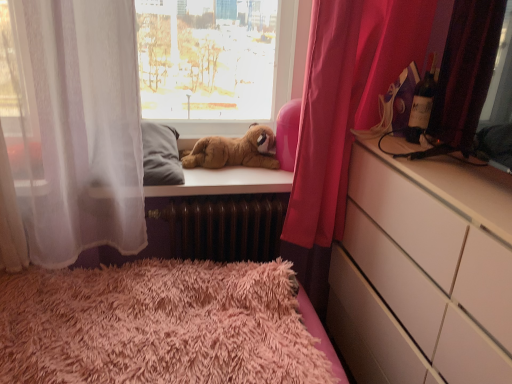
The width and height of the screenshot is (512, 384). What are the coordinates of `matte glass bottle at right` in the screenshot? It's located at (422, 103).

What do you see at coordinates (466, 71) in the screenshot? I see `velvet dark red curtain at right, marked as the second curtain in a back-to-front arrangement` at bounding box center [466, 71].

Where is `brown plush bear at upper center`? brown plush bear at upper center is located at coordinates (232, 151).

Measure the distance between point (238, 155) and camera.

6.08 feet.

The image size is (512, 384). In order to click on white glossy chest of drawers at right in this screenshot , I will do `click(424, 272)`.

Where is `matte glass bottle at right`? This screenshot has height=384, width=512. matte glass bottle at right is located at coordinates (422, 103).

Which is nearer, (467,354) or (415,127)?

The point (467,354) is closer.

Image resolution: width=512 pixels, height=384 pixels. There is a white glossy chest of drawers at right. In order to click on bottle above it (from a real-world perspective) in this screenshot , I will do [x=422, y=103].

Is white glossy chest of drawers at right oriented away from matte glass bottle at right?

No, white glossy chest of drawers at right is not facing the opposite direction of matte glass bottle at right.

How much distance is there between velvet dark red curtain at right, marked as the second curtain in a back-to-front arrangement, and pink fabric curtain at right, acting as the second curtain starting from the front?

velvet dark red curtain at right, marked as the second curtain in a back-to-front arrangement, and pink fabric curtain at right, acting as the second curtain starting from the front, are 14.71 inches apart.

From the picture: Would you consider velvet dark red curtain at right, acting as the first curtain starting from the front, to be distant from pink fabric curtain at right, which is the 1th curtain in back-to-front order?

Actually, velvet dark red curtain at right, acting as the first curtain starting from the front, and pink fabric curtain at right, which is the 1th curtain in back-to-front order, are a little close together.

Does velvet dark red curtain at right, acting as the first curtain starting from the front, turn towards pink fabric curtain at right, acting as the second curtain starting from the front?

No.

Considering the sizes of velvet dark red curtain at right, acting as the first curtain starting from the front, and pink fabric curtain at right, acting as the second curtain starting from the front, in the image, is velvet dark red curtain at right, acting as the first curtain starting from the front, taller or shorter than pink fabric curtain at right, acting as the second curtain starting from the front,?

In the image, velvet dark red curtain at right, acting as the first curtain starting from the front, appears to be shorter than pink fabric curtain at right, acting as the second curtain starting from the front.

From the picture: From a real-world perspective, is brown plush bear at upper center under velvet dark red curtain at right, acting as the first curtain starting from the front?

Yes, from a real-world perspective, brown plush bear at upper center is beneath velvet dark red curtain at right, acting as the first curtain starting from the front.

Can you confirm if brown plush bear at upper center is bigger than velvet dark red curtain at right, marked as the second curtain in a back-to-front arrangement?

Actually, brown plush bear at upper center might be smaller than velvet dark red curtain at right, marked as the second curtain in a back-to-front arrangement.

Looking at this image, is brown plush bear at upper center oriented towards velvet dark red curtain at right, acting as the first curtain starting from the front?

No, brown plush bear at upper center is not oriented towards velvet dark red curtain at right, acting as the first curtain starting from the front.

Which object is more forward, white glossy chest of drawers at right or brown plush bear at upper center?

white glossy chest of drawers at right is more forward.

Considering the positions of objects white glossy chest of drawers at right and brown plush bear at upper center in the image provided, who is more to the left, white glossy chest of drawers at right or brown plush bear at upper center?

brown plush bear at upper center.

Considering the sizes of objects white glossy chest of drawers at right and brown plush bear at upper center in the image provided, who is taller, white glossy chest of drawers at right or brown plush bear at upper center?

With more height is white glossy chest of drawers at right.

Can you see white glossy chest of drawers at right touching brown plush bear at upper center?

No, white glossy chest of drawers at right is not making contact with brown plush bear at upper center.

From a real-world perspective, is velvet dark red curtain at right, marked as the second curtain in a back-to-front arrangement, beneath white glossy chest of drawers at right?

No, from a real-world perspective, velvet dark red curtain at right, marked as the second curtain in a back-to-front arrangement, is not below white glossy chest of drawers at right.

Is velvet dark red curtain at right, marked as the second curtain in a back-to-front arrangement, facing away from white glossy chest of drawers at right?

That's not correct — velvet dark red curtain at right, marked as the second curtain in a back-to-front arrangement, is not looking away from white glossy chest of drawers at right.

You are a GUI agent. You are given a task and a screenshot of the screen. Output one action in this format:
    pyautogui.click(x=<x>, y=<y>)
    Task: Click on the chest of drawers below the velvet dark red curtain at right, marked as the second curtain in a back-to-front arrangement (from the image's perspective)
    The height and width of the screenshot is (384, 512).
    Given the screenshot: What is the action you would take?
    pyautogui.click(x=424, y=272)

How many degrees apart are the facing directions of velvet dark red curtain at right, acting as the first curtain starting from the front, and white glossy chest of drawers at right?

The angle between the facing direction of velvet dark red curtain at right, acting as the first curtain starting from the front, and the facing direction of white glossy chest of drawers at right is 0.0898 degrees.

Is white glossy chest of drawers at right looking in the opposite direction of pink fabric curtain at right, which is the 1th curtain in back-to-front order?

No, white glossy chest of drawers at right is not facing the opposite direction of pink fabric curtain at right, which is the 1th curtain in back-to-front order.

Is white glossy chest of drawers at right placed right next to pink fabric curtain at right, which is the 1th curtain in back-to-front order?

There is a gap between white glossy chest of drawers at right and pink fabric curtain at right, which is the 1th curtain in back-to-front order.

Can you confirm if white glossy chest of drawers at right is bigger than pink fabric curtain at right, acting as the second curtain starting from the front?

Correct, white glossy chest of drawers at right is larger in size than pink fabric curtain at right, acting as the second curtain starting from the front.

Is point (416, 320) farther from viewer compared to point (291, 243)?

No.

From the image's perspective, between velvet dark red curtain at right, marked as the second curtain in a back-to-front arrangement, and matte glass bottle at right, which one is located above?

matte glass bottle at right, from the image's perspective.

Looking at this image, considering the sizes of velvet dark red curtain at right, acting as the first curtain starting from the front, and matte glass bottle at right in the image, is velvet dark red curtain at right, acting as the first curtain starting from the front, taller or shorter than matte glass bottle at right?

A: Considering their sizes, velvet dark red curtain at right, acting as the first curtain starting from the front, has more height than matte glass bottle at right.

What's the angular difference between velvet dark red curtain at right, acting as the first curtain starting from the front, and matte glass bottle at right's facing directions?

0.552 degrees.

From a real-world perspective, is velvet dark red curtain at right, marked as the second curtain in a back-to-front arrangement, physically located above or below matte glass bottle at right?

velvet dark red curtain at right, marked as the second curtain in a back-to-front arrangement, is situated higher than matte glass bottle at right in the real world.

The width and height of the screenshot is (512, 384). Find the location of `chest of drawers below the matte glass bottle at right (from the image's perspective)`. chest of drawers below the matte glass bottle at right (from the image's perspective) is located at coordinates (424, 272).

Where is `curtain on the right of pink fabric curtain at right, acting as the second curtain starting from the front`? curtain on the right of pink fabric curtain at right, acting as the second curtain starting from the front is located at coordinates (466, 71).

When comparing their distances from brown plush bear at upper center, does velvet dark red curtain at right, marked as the second curtain in a back-to-front arrangement, or matte glass bottle at right seem closer?

Among the two, matte glass bottle at right is located nearer to brown plush bear at upper center.

Looking at the image, which one is located closer to matte glass bottle at right, velvet dark red curtain at right, acting as the first curtain starting from the front, or white glossy chest of drawers at right?

velvet dark red curtain at right, acting as the first curtain starting from the front, is closer to matte glass bottle at right.

Based on their spatial positions, is velvet dark red curtain at right, acting as the first curtain starting from the front, or pink fabric curtain at right, which is the 1th curtain in back-to-front order, closer to white glossy chest of drawers at right?

The object closer to white glossy chest of drawers at right is velvet dark red curtain at right, acting as the first curtain starting from the front.

When comparing their distances from white glossy chest of drawers at right, does matte glass bottle at right or velvet dark red curtain at right, marked as the second curtain in a back-to-front arrangement, seem closer?

velvet dark red curtain at right, marked as the second curtain in a back-to-front arrangement.

Estimate the real-world distances between objects in this image. Which object is further from velvet dark red curtain at right, marked as the second curtain in a back-to-front arrangement, white glossy chest of drawers at right or brown plush bear at upper center?

brown plush bear at upper center lies further to velvet dark red curtain at right, marked as the second curtain in a back-to-front arrangement, than the other object.

From the image, which object appears to be nearer to matte glass bottle at right, brown plush bear at upper center or pink fabric curtain at right, which is the 1th curtain in back-to-front order?

pink fabric curtain at right, which is the 1th curtain in back-to-front order, is positioned closer to the anchor matte glass bottle at right.

When comparing their distances from matte glass bottle at right, does white glossy chest of drawers at right or velvet dark red curtain at right, acting as the first curtain starting from the front, seem closer?

Based on the image, velvet dark red curtain at right, acting as the first curtain starting from the front, appears to be nearer to matte glass bottle at right.

Considering their positions, is pink fabric curtain at right, which is the 1th curtain in back-to-front order, positioned closer to white glossy chest of drawers at right than matte glass bottle at right?

Based on the image, pink fabric curtain at right, which is the 1th curtain in back-to-front order, appears to be nearer to white glossy chest of drawers at right.

Find the location of a particular element. Image resolution: width=512 pixels, height=384 pixels. curtain between velvet dark red curtain at right, marked as the second curtain in a back-to-front arrangement, and white glossy chest of drawers at right, in the vertical direction is located at coordinates (343, 117).

At what (x,y) coordinates should I click in order to perform the action: click on the chest of drawers located between velvet dark red curtain at right, acting as the first curtain starting from the front, and brown plush bear at upper center in the depth direction. Please return your answer as a coordinate pair (x, y). This screenshot has height=384, width=512. Looking at the image, I should click on (424, 272).

Locate an element on the screen. The width and height of the screenshot is (512, 384). curtain between brown plush bear at upper center and matte glass bottle at right from left to right is located at coordinates (343, 117).

Identify the location of curtain between velvet dark red curtain at right, marked as the second curtain in a back-to-front arrangement, and matte glass bottle at right in the front-back direction. This screenshot has width=512, height=384. (343, 117).